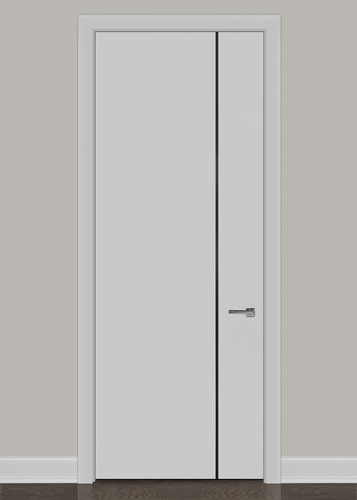
The width and height of the screenshot is (357, 500). Identify the location of left side of door. (150, 268).